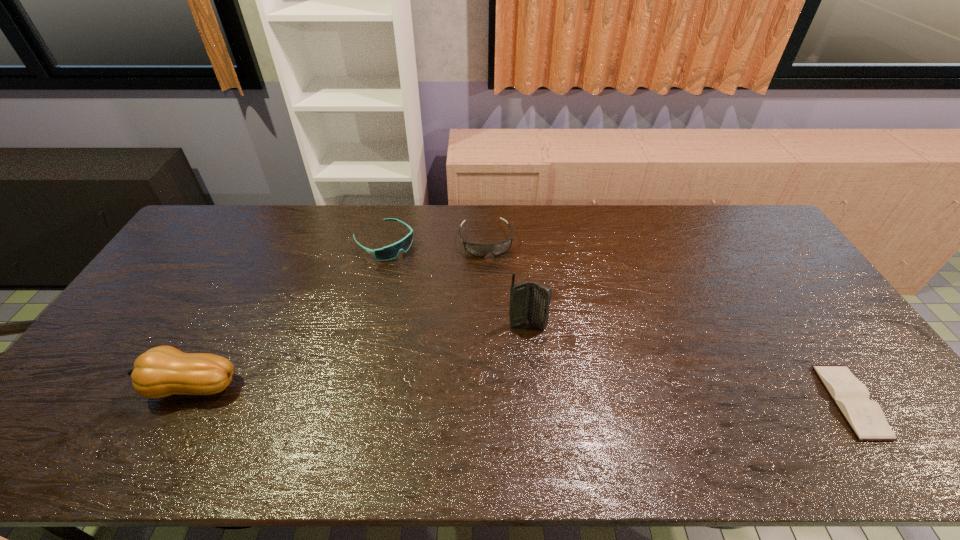
Locate an element on the screen. free spot between the goggles and the fourth object from right to left is located at coordinates (435, 241).

The height and width of the screenshot is (540, 960). I want to click on free point between the goggles and the shortest object, so click(668, 321).

Where is `vacant space that is in between the cellular telephone and the rightmost object`? vacant space that is in between the cellular telephone and the rightmost object is located at coordinates click(x=689, y=363).

Where is `vacant area that lies between the tallest object and the second tallest object`? vacant area that lies between the tallest object and the second tallest object is located at coordinates (358, 356).

At what (x,y) coordinates should I click in order to perform the action: click on empty location between the second object from left to right and the second tallest object. Please return your answer as a coordinate pair (x, y). Looking at the image, I should click on (286, 314).

Image resolution: width=960 pixels, height=540 pixels. What are the coordinates of `vacant point located between the sunglasses and the goggles` in the screenshot? It's located at (435, 241).

Find the location of a particular element. free space between the sunglasses and the cellular telephone is located at coordinates (456, 284).

The height and width of the screenshot is (540, 960). I want to click on vacant space that's between the rightmost object and the cellular telephone, so click(689, 363).

You are a GUI agent. You are given a task and a screenshot of the screen. Output one action in this format:
    pyautogui.click(x=<x>, y=<y>)
    Task: Click on the free spot between the shortest object and the fourth shortest object
    
    Given the screenshot: What is the action you would take?
    pyautogui.click(x=519, y=394)

This screenshot has height=540, width=960. Identify the location of free space between the fourth object from right to left and the goggles. (435, 241).